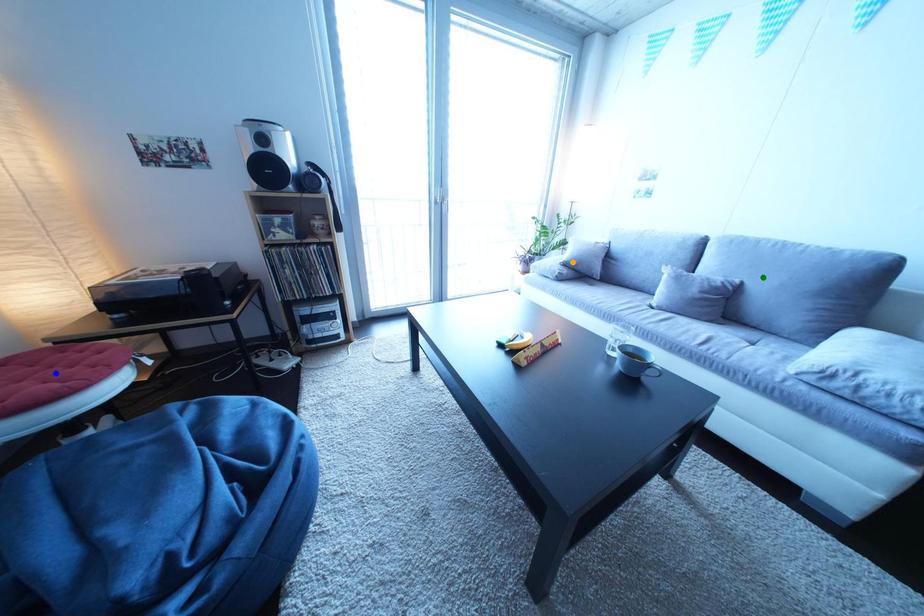
Order these from nearest to farthest:
green point, blue point, orange point

blue point
green point
orange point